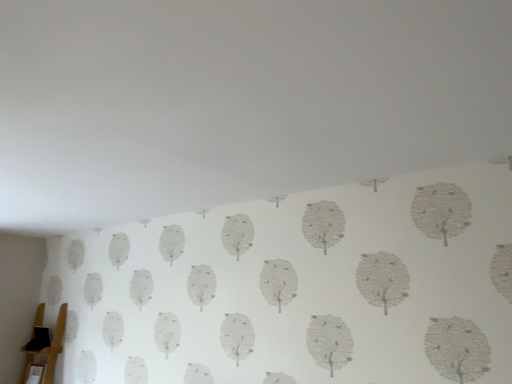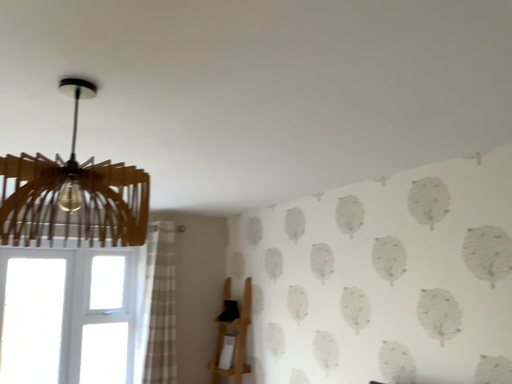
Question: How did the camera likely rotate when shooting the video?

Choices:
 (A) rotated right
 (B) rotated left

Answer: (B)